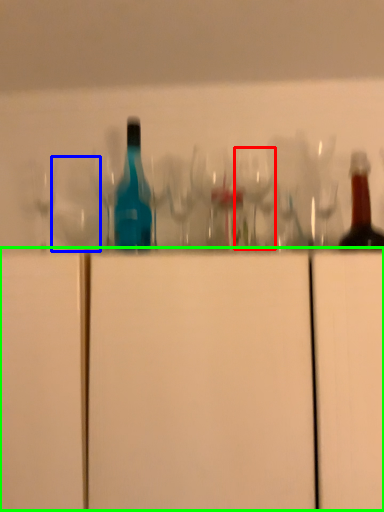
Question: Which object is the closest to the wine glass (highlighted by a red box)? Choose among these: shot glass (highlighted by a blue box) or cabinetry (highlighted by a green box).

Choices:
 (A) shot glass
 (B) cabinetry

Answer: (A)